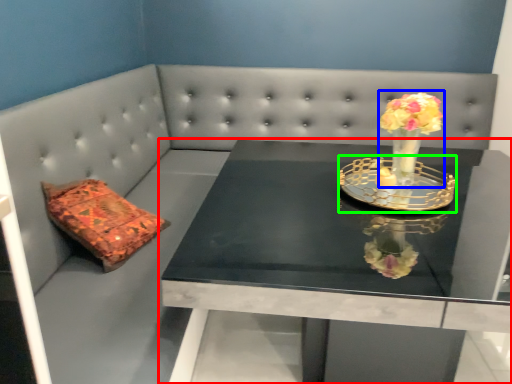
Question: Considering the real-world distances, which object is farthest from table (highlighted by a red box)? floral arrangement (highlighted by a blue box) or candle holder (highlighted by a green box)?

Choices:
 (A) floral arrangement
 (B) candle holder

Answer: (A)